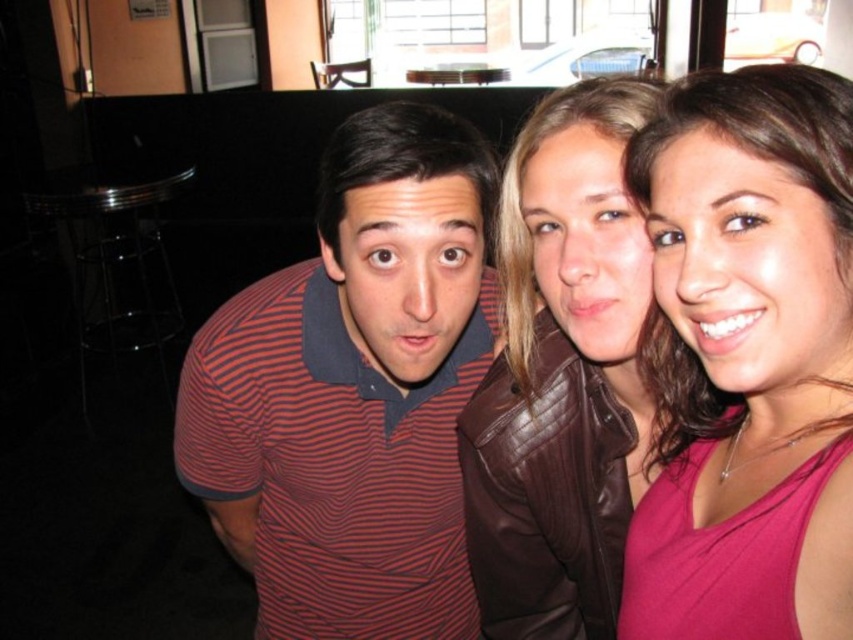
Does striped polo shirt at center have a smaller size compared to brown leather jacket at upper right?

Actually, striped polo shirt at center might be larger than brown leather jacket at upper right.

Is point (509, 515) closer to camera compared to point (579, 152)?

No, (509, 515) is behind (579, 152).

The height and width of the screenshot is (640, 853). I want to click on striped polo shirt at center, so coord(599,358).

Who is more forward, (222, 413) or (630, 582)?

Point (630, 582) is more forward.

Who is taller, striped cotton polo shirt at center or pink matte tank top at center?

Standing taller between the two is striped cotton polo shirt at center.

The width and height of the screenshot is (853, 640). Describe the element at coordinates (352, 392) in the screenshot. I see `striped cotton polo shirt at center` at that location.

At what (x,y) coordinates should I click in order to perform the action: click on striped cotton polo shirt at center. Please return your answer as a coordinate pair (x, y). The width and height of the screenshot is (853, 640). Looking at the image, I should click on (352, 392).

Is striped cotton polo shirt at center thinner than striped polo shirt at center?

No.

This screenshot has height=640, width=853. Describe the element at coordinates (352, 392) in the screenshot. I see `striped cotton polo shirt at center` at that location.

Which is in front, point (273, 276) or point (776, 113)?

Positioned in front is point (776, 113).

Where is `striped cotton polo shirt at center`? This screenshot has width=853, height=640. striped cotton polo shirt at center is located at coordinates (352, 392).